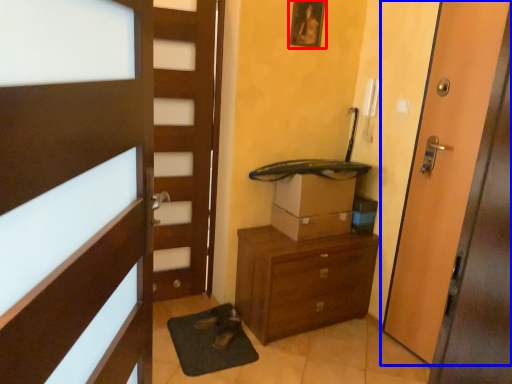
Question: Which point is further to the camera, picture frame (highlighted by a red box) or door (highlighted by a blue box)?

Choices:
 (A) picture frame
 (B) door

Answer: (A)